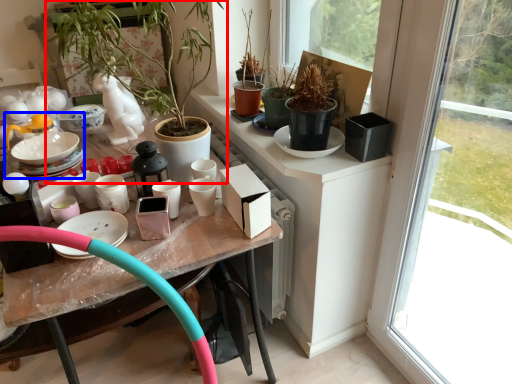
Question: Which object appears closest to the camera in this image, houseplant (highlighted by a red box) or tea set (highlighted by a blue box)?

Choices:
 (A) houseplant
 (B) tea set

Answer: (A)